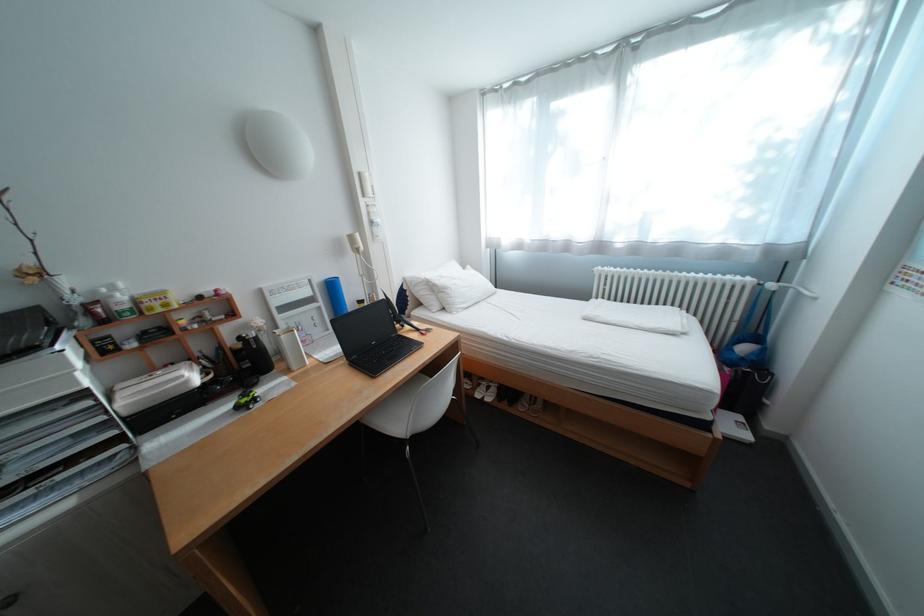
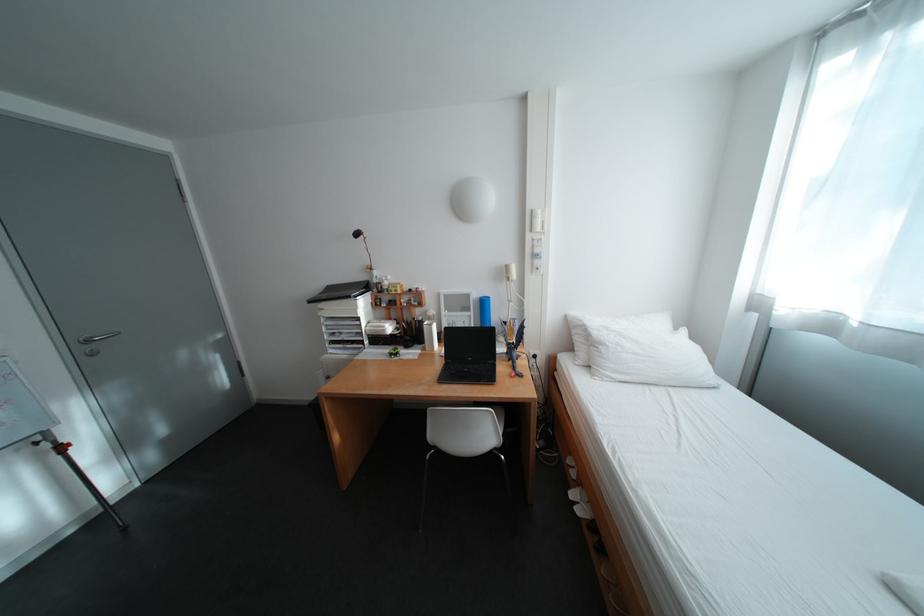
In the second image, find the point that corresponds to (x=374, y=203) in the first image.

(541, 237)